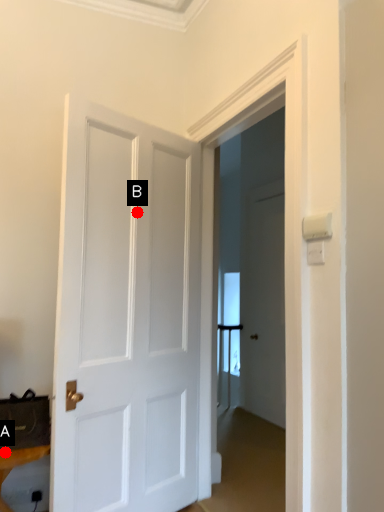
Question: Two points are circled on the image, labeled by A and B beside each circle. Among these points, which one is farthest from the camera?

Choices:
 (A) A is further
 (B) B is further

Answer: (B)